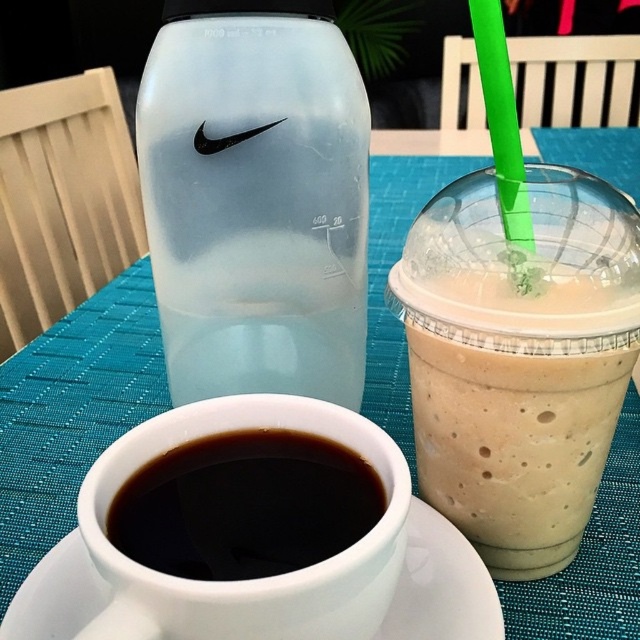
Question: Can you confirm if milkshake plastic cup at right is wider than white ceramic saucer at lower center?

Choices:
 (A) no
 (B) yes

Answer: (A)

Question: Observing the image, what is the correct spatial positioning of milkshake plastic cup at right in reference to black matte cup at center?

Choices:
 (A) right
 (B) left

Answer: (A)

Question: Observing the image, what is the correct spatial positioning of frosted glass bottle at center in reference to black matte cup at center?

Choices:
 (A) above
 (B) below

Answer: (A)

Question: Which of the following is the closest to the observer?

Choices:
 (A) milkshake plastic cup at right
 (B) white ceramic saucer at lower center
 (C) black matte cup at center

Answer: (C)

Question: Which point is closer to the camera?

Choices:
 (A) (244, 116)
 (B) (582, 202)
 (C) (195, 572)
 (D) (67, 570)

Answer: (C)

Question: Which point is farther from the camera taking this photo?

Choices:
 (A) coord(113,531)
 (B) coord(387,616)
 (C) coord(577,384)

Answer: (B)